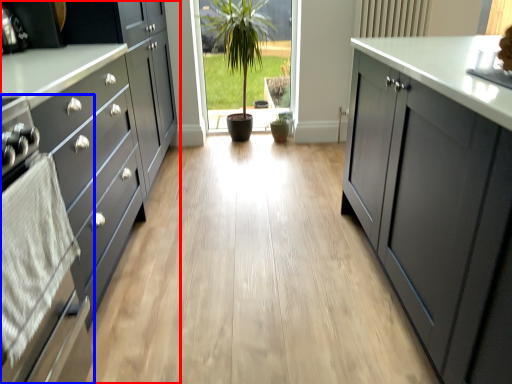
Question: Among these objects, which one is nearest to the camera, cabinetry (highlighted by a red box) or oven (highlighted by a blue box)?

Choices:
 (A) cabinetry
 (B) oven

Answer: (B)